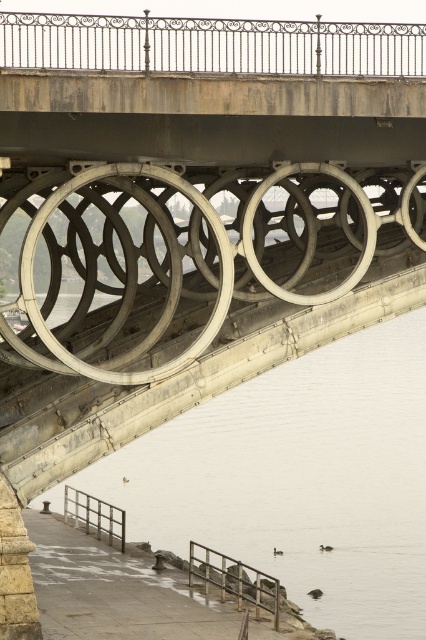
Question: Considering the real-world distances, which object is farthest from the metal/rustic rail at lower center?

Choices:
 (A) white smooth water at lower center
 (B) metallic gray railing at lower left

Answer: (A)

Question: Can you confirm if white smooth water at lower center is positioned above metallic gray railing at lower left?

Choices:
 (A) yes
 (B) no

Answer: (A)

Question: Which of these objects is positioned farthest from the white smooth water at lower center?

Choices:
 (A) metallic gray railing at lower left
 (B) metal/rustic rail at lower center

Answer: (A)

Question: From the image, what is the correct spatial relationship of metal/rustic rail at lower center in relation to metallic gray railing at lower left?

Choices:
 (A) above
 (B) below

Answer: (B)

Question: Which point is closer to the camera?

Choices:
 (A) (377, 324)
 (B) (80, 492)

Answer: (B)

Question: Observing the image, what is the correct spatial positioning of white smooth water at lower center in reference to metal/rustic rail at lower center?

Choices:
 (A) above
 (B) below

Answer: (A)